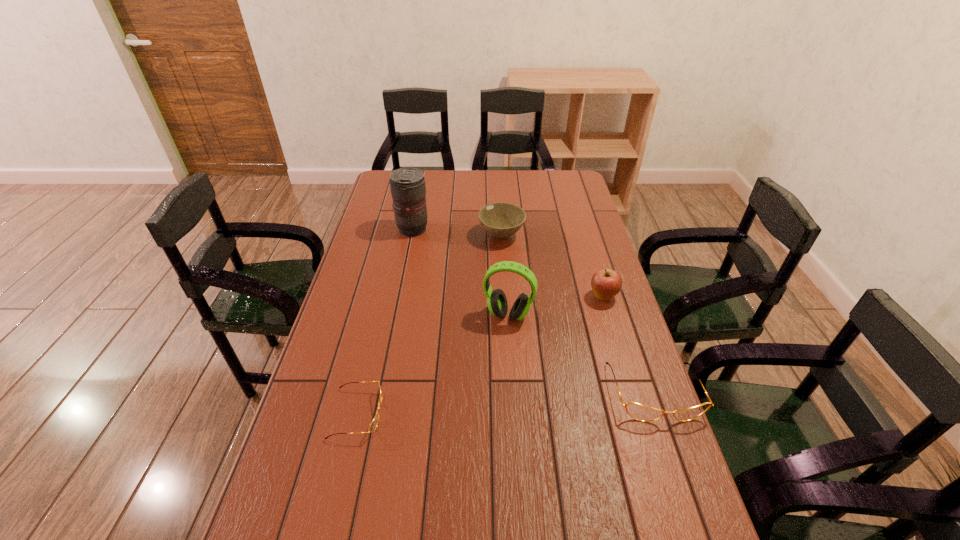
The image size is (960, 540). I want to click on free space between the fifth shortest object and the bowl, so (x=505, y=275).

Where is `free space between the third shortest object and the fifth shortest object`? Image resolution: width=960 pixels, height=540 pixels. free space between the third shortest object and the fifth shortest object is located at coordinates (505, 275).

Locate an element on the screen. free space between the shortest object and the fourth tallest object is located at coordinates (429, 325).

Locate an element on the screen. Image resolution: width=960 pixels, height=540 pixels. object that is the fourth nearest to the bowl is located at coordinates (637, 411).

Point out which object is positioned as the fourth nearest to the tallest object. Please provide its 2D coordinates. Your answer should be formatted as a tuple, i.e. [(x, y)], where the tuple contains the x and y coordinates of a point satisfying the conditions above.

[(373, 425)]

The image size is (960, 540). In order to click on vacant area that satisfies the following two spatial constraints: 1. on the side of the telephoto lens where the control switches are located; 2. on the back side of the fourth shortest object in this screenshot , I will do `click(399, 296)`.

I want to click on vacant space that satisfies the following two spatial constraints: 1. on the back side of the apple; 2. on the side of the tallest object where the control switches are located, so click(583, 230).

The width and height of the screenshot is (960, 540). I want to click on vacant space that satisfies the following two spatial constraints: 1. on the front-facing side of the taller spectacles; 2. on the front-facing side of the shortest object, so click(x=661, y=413).